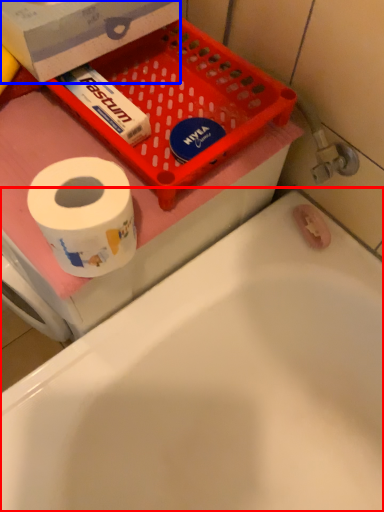
Question: Which object appears closest to the camera in this image, bathtub (highlighted by a red box) or box (highlighted by a blue box)?

Choices:
 (A) bathtub
 (B) box

Answer: (A)